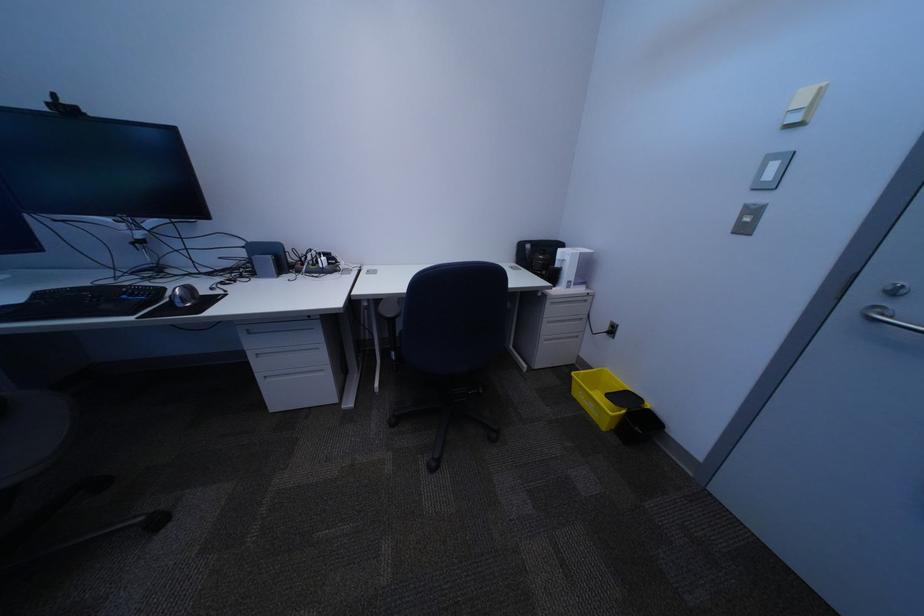
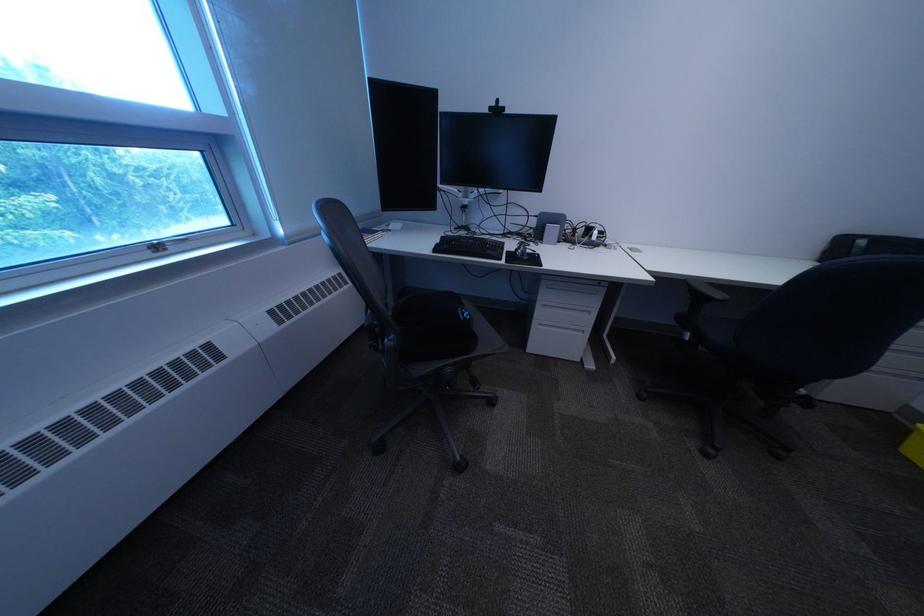
Question: The camera is either moving clockwise (left) or counter-clockwise (right) around the object. The first image is from the beginning of the video and the second image is from the end. Is the camera moving left or right when shooting the video?

Choices:
 (A) Left
 (B) Right

Answer: (B)